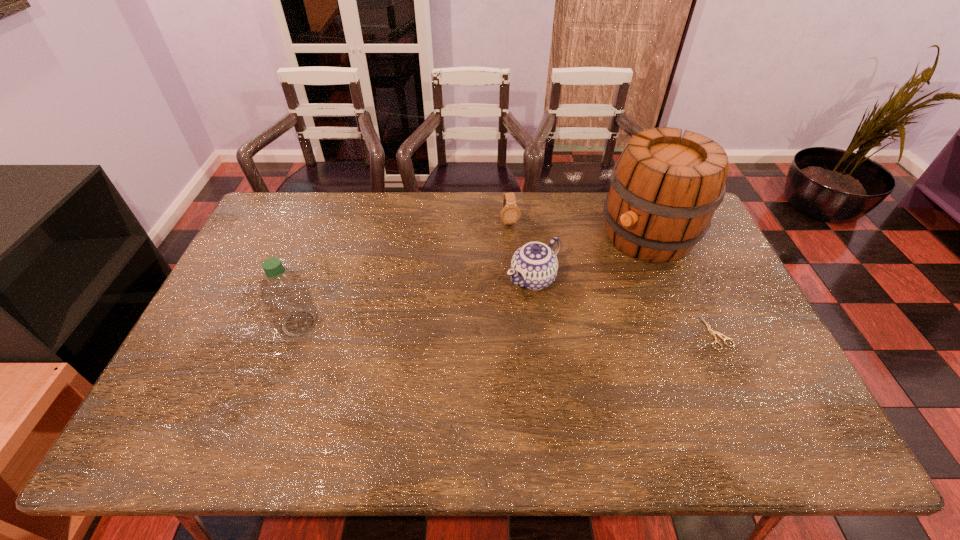
This screenshot has height=540, width=960. What are the coordinates of `free space located at the spout of the third shortest object` in the screenshot? It's located at (409, 372).

Find the location of a particular element. Image resolution: width=960 pixels, height=540 pixels. vacant region located 0.290m on the face of the watch is located at coordinates (527, 292).

What are the coordinates of `vacant space situated 0.290m on the face of the watch` in the screenshot? It's located at 527,292.

Identify the location of vacant space located 0.340m on the face of the watch. (530, 304).

The height and width of the screenshot is (540, 960). What are the coordinates of `vacant space located on the side of the tallest object where the spigot is located` in the screenshot? It's located at (539, 319).

You are a GUI agent. You are given a task and a screenshot of the screen. Output one action in this format:
    pyautogui.click(x=<x>, y=<y>)
    Task: Click on the vacant area located on the side of the tallest object where the spigot is located
    The image size is (960, 540).
    Given the screenshot: What is the action you would take?
    pyautogui.click(x=570, y=295)

At what (x,y) coordinates should I click in order to perform the action: click on vacant area located on the side of the tallest object where the spigot is located. Please return your answer as a coordinate pair (x, y). Looking at the image, I should click on (575, 292).

Find the location of a particular element. The image size is (960, 540). watch that is at the far edge is located at coordinates (510, 213).

The height and width of the screenshot is (540, 960). I want to click on cider that is at the far edge, so click(x=664, y=190).

In order to click on shears positioned at the right edge in this screenshot , I will do `click(709, 329)`.